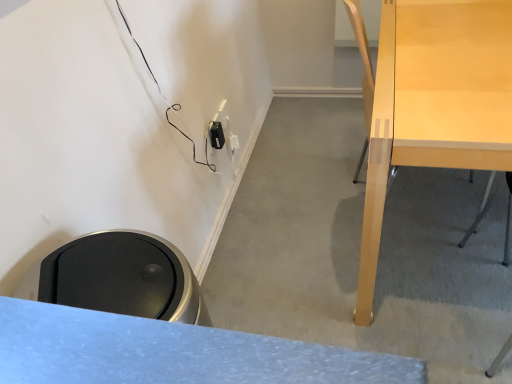
Question: Is black plastic electric outlet at lower center taller or shorter than light wood desk at right?

Choices:
 (A) tall
 (B) short

Answer: (B)

Question: Considering the positions of point (221, 130) and point (396, 92), is point (221, 130) closer or farther from the camera than point (396, 92)?

Choices:
 (A) closer
 (B) farther

Answer: (B)

Question: In the image, is black plastic electric outlet at lower center positioned in front of or behind light wood desk at right?

Choices:
 (A) front
 (B) behind

Answer: (B)

Question: From a real-world perspective, relative to black plastic electric outlet at lower center, is light wood desk at right vertically above or below?

Choices:
 (A) above
 (B) below

Answer: (B)

Question: In the image, is light wood desk at right on the left side or the right side of black plastic electric outlet at lower center?

Choices:
 (A) right
 (B) left

Answer: (A)

Question: In terms of size, does light wood desk at right appear bigger or smaller than black plastic electric outlet at lower center?

Choices:
 (A) big
 (B) small

Answer: (A)

Question: Is light wood desk at right inside or outside of black plastic electric outlet at lower center?

Choices:
 (A) outside
 (B) inside

Answer: (A)